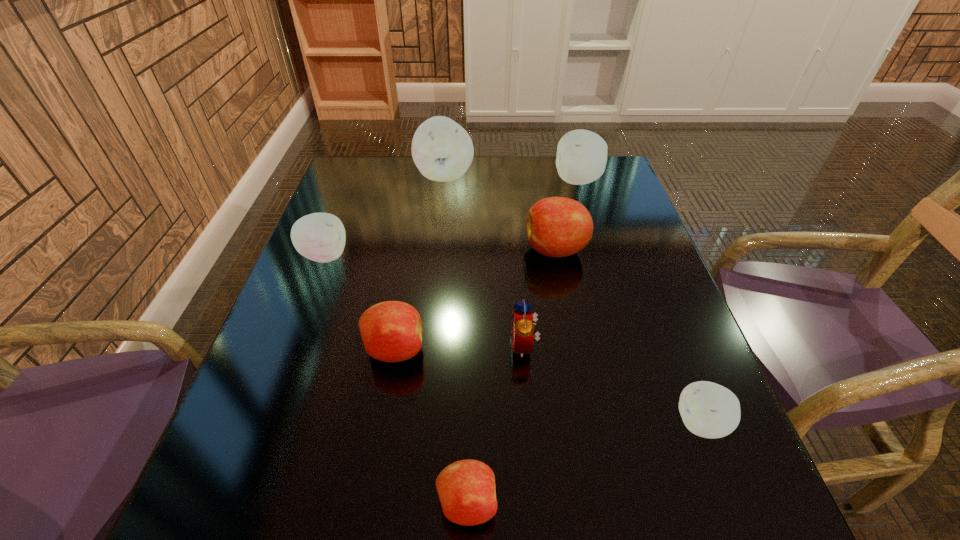
You are a GUI agent. You are given a task and a screenshot of the screen. Output one action in this format:
    pyautogui.click(x=<x>, y=<y>)
    Task: Click on the sixth farthest apple
    This screenshot has width=960, height=540.
    Given the screenshot: What is the action you would take?
    pyautogui.click(x=709, y=410)

You are a GUI agent. You are given a task and a screenshot of the screen. Output one action in this format:
    pyautogui.click(x=<x>, y=<y>)
    Task: Click on the smallest white apple
    The image size is (960, 540).
    Given the screenshot: What is the action you would take?
    pyautogui.click(x=709, y=410)

Where is `the second red apple from right to left`? This screenshot has width=960, height=540. the second red apple from right to left is located at coordinates (466, 488).

Identify the location of the nearest red apple. (466, 488).

At what (x,y) coordinates should I click in order to perform the action: click on vacant space positioned on the left of the second white apple from left to right. Please return your answer as a coordinate pair (x, y). Looking at the image, I should click on (347, 176).

This screenshot has width=960, height=540. Identify the location of vacant space positioned 0.340m on the front of the third smallest white apple. [x=607, y=276].

The height and width of the screenshot is (540, 960). Find the location of `vacant space located 0.180m on the front of the rightmost red apple`. vacant space located 0.180m on the front of the rightmost red apple is located at coordinates click(571, 329).

Image resolution: width=960 pixels, height=540 pixels. In order to click on vacant point located on the back of the leftmost white apple in this screenshot , I will do `click(357, 172)`.

Where is `vacant space located on the front-facing side of the alarm clock`? The width and height of the screenshot is (960, 540). vacant space located on the front-facing side of the alarm clock is located at coordinates (342, 345).

The image size is (960, 540). I want to click on vacant space located on the front-facing side of the alarm clock, so click(x=386, y=345).